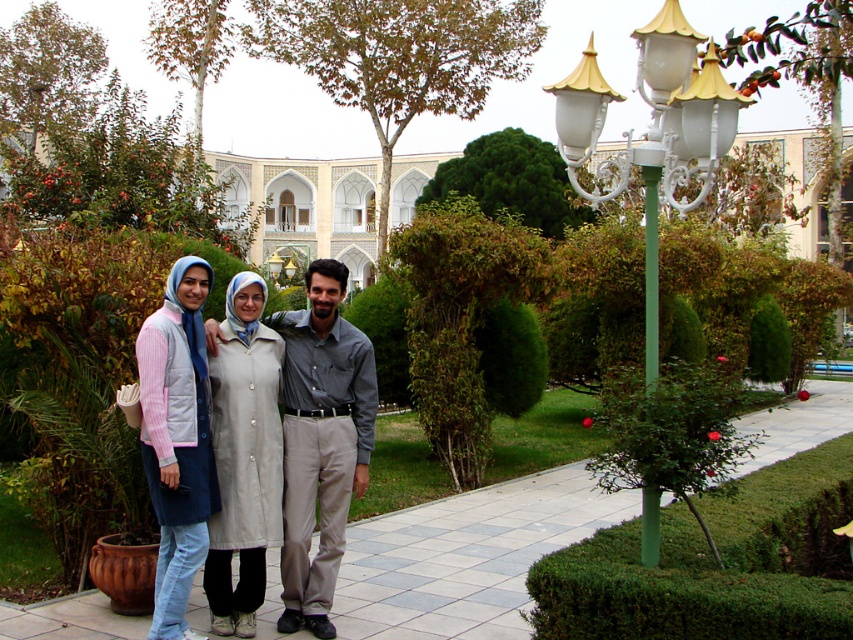
Consider the image. Can you confirm if gray cotton shirt at center is positioned above light pink striped shirt at center?

No, gray cotton shirt at center is not above light pink striped shirt at center.

Which is more to the right, gray cotton shirt at center or light pink striped shirt at center?

gray cotton shirt at center

Between point (297, 628) and point (202, 403), which one is positioned behind?

The point (297, 628) is behind.

Identify the location of gray cotton shirt at center. (321, 442).

Who is more forward, (212,458) or (299,531)?

Point (212,458)

From the picture: Is light gray fabric coat at center to the left of gray cotton shirt at center from the viewer's perspective?

Correct, you'll find light gray fabric coat at center to the left of gray cotton shirt at center.

What do you see at coordinates (206, 449) in the screenshot? This screenshot has width=853, height=640. I see `light gray fabric coat at center` at bounding box center [206, 449].

Where is `light gray fabric coat at center`? light gray fabric coat at center is located at coordinates (206, 449).

Is gray cotton shirt at center above white glossy lamp post at upper right?

No.

Who is taller, gray cotton shirt at center or white glossy lamp post at upper right?

white glossy lamp post at upper right

Identify the location of gray cotton shirt at center. (321, 442).